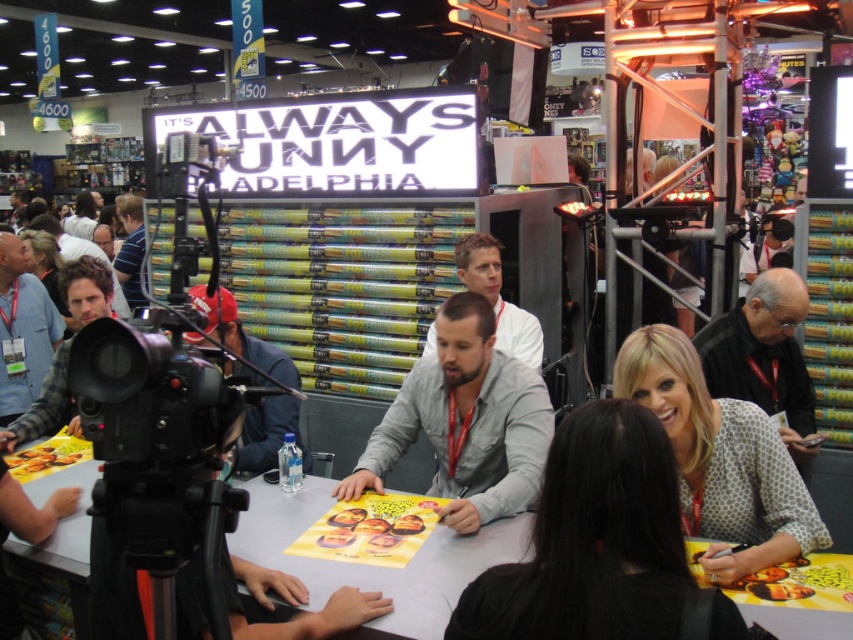
Which is below, light gray shirt at center or blue shirt at left?

Positioned lower is light gray shirt at center.

Between light gray shirt at center and blue shirt at left, which one appears on the left side from the viewer's perspective?

blue shirt at left

Is point (519, 353) positioned before point (126, 292)?

Yes, it is.

Find the location of a particular element. The width and height of the screenshot is (853, 640). light gray shirt at center is located at coordinates (498, 298).

Who is higher up, gray matte shirt at center or plaid flannel shirt at left?

Positioned higher is plaid flannel shirt at left.

Can you confirm if gray matte shirt at center is bigger than plaid flannel shirt at left?

Yes, gray matte shirt at center is bigger than plaid flannel shirt at left.

Where is `gray matte shirt at center`? gray matte shirt at center is located at coordinates (465, 422).

Image resolution: width=853 pixels, height=640 pixels. I want to click on gray matte shirt at center, so click(465, 422).

Who is positioned more to the left, matte black cap at center or blue shirt at left?

blue shirt at left is more to the left.

Between point (283, 371) and point (129, 253), which one is positioned behind?

The point (129, 253) is behind.

Find the location of a particular element. matte black cap at center is located at coordinates (268, 435).